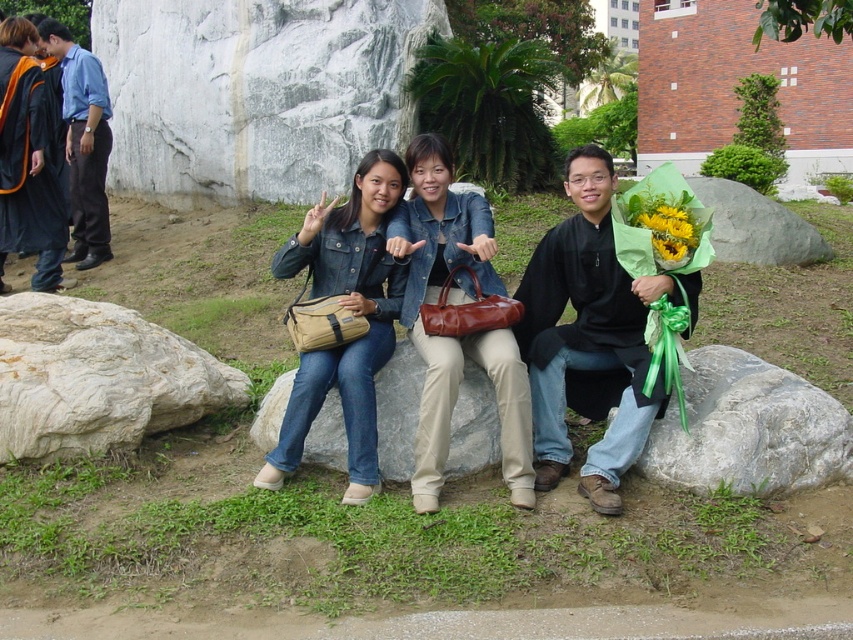
You are standing in front of the large gray rock where the three people are sitting. You want to take a photo of the person wearing the matte black jacket at center and the blue jeans at center. Which one should you focus on first if you want to capture both in the same frame without moving the camera?

You should focus on the matte black jacket at center first because it is positioned to the left of the blue jeans at center, so capturing it first ensures both are within the frame.

In the scene shown: You are standing in the park and see three people sitting on a large gray rock. You need to find the matte black jacket at center. Where exactly should you look?

You should look at point 0.408 on the y axis and 0.484 on the x axis to find the matte black jacket at center.